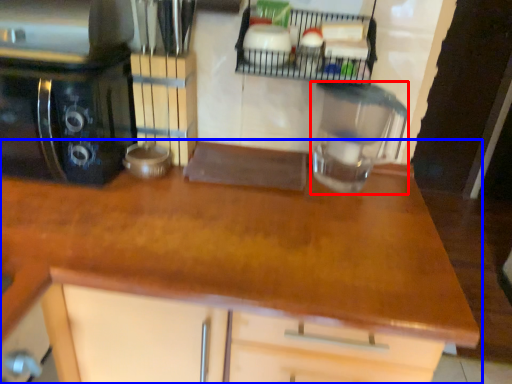
Question: Which object appears closest to the camera in this image, kitchen appliance (highlighted by a red box) or countertop (highlighted by a blue box)?

Choices:
 (A) kitchen appliance
 (B) countertop

Answer: (B)